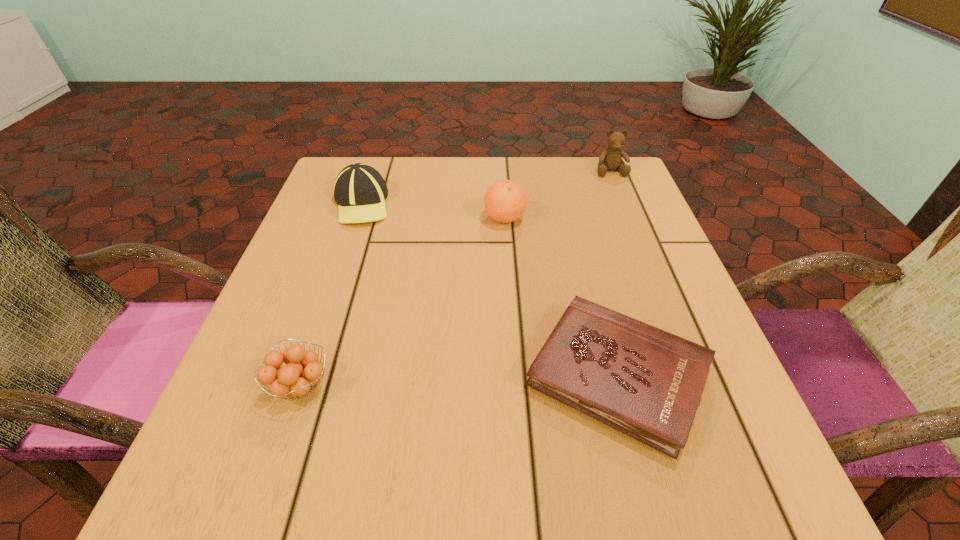
Choose which object is the fourth nearest neighbor to the right orange fruit. Please provide its 2D coordinates. Your answer should be formatted as a tuple, i.e. [(x, y)], where the tuple contains the x and y coordinates of a point satisfying the conditions above.

[(295, 379)]

You are a GUI agent. You are given a task and a screenshot of the screen. Output one action in this format:
    pyautogui.click(x=<x>, y=<y>)
    Task: Click on the free region that satisfies the following two spatial constraints: 1. with the brim of the shortest object facing forward; 2. on the left side of the baseball cap
    The image size is (960, 540).
    Given the screenshot: What is the action you would take?
    pyautogui.click(x=303, y=376)

Locate an element on the screen. The image size is (960, 540). free space that satisfies the following two spatial constraints: 1. with the brim of the baseball cap facing forward; 2. on the right side of the hardback book is located at coordinates (303, 376).

Where is `vacant region that satisfies the following two spatial constraints: 1. with the brim of the baseball cap facing forward; 2. on the left side of the hardback book`? This screenshot has width=960, height=540. vacant region that satisfies the following two spatial constraints: 1. with the brim of the baseball cap facing forward; 2. on the left side of the hardback book is located at coordinates (303, 376).

The image size is (960, 540). Identify the location of vacant area that satisfies the following two spatial constraints: 1. with the brim of the shortest object facing forward; 2. on the right side of the baseball cap. (303, 376).